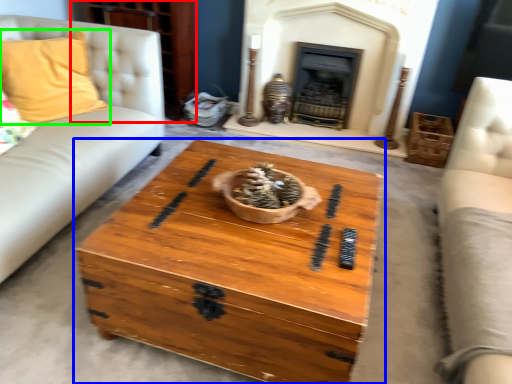
Question: Based on their relative distances, which object is nearer to dresser (highlighted by a red box)? Choose from coffee table (highlighted by a blue box) and pillow (highlighted by a green box).

Choices:
 (A) coffee table
 (B) pillow

Answer: (B)